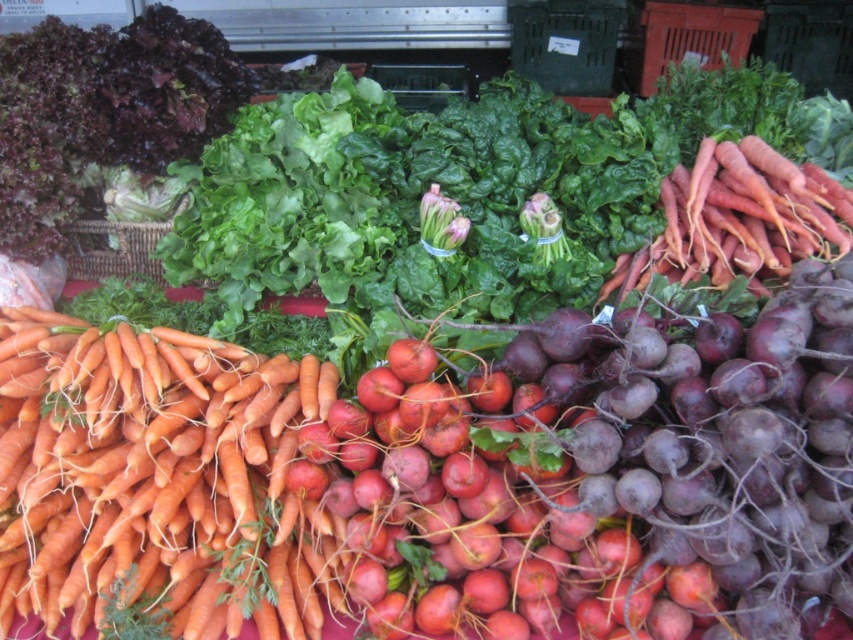
In the scene shown: You are a customer at the market stall and want to buy carrots. You see two groups of orange matte carrots at left and orange matte carrots at upper right. Which group has bigger carrots?

The orange matte carrots at left are larger in size than the orange matte carrots at upper right, so the group at the left has bigger carrots.

You are a customer at the market stall and want to grab both the orange matte carrots at left and the orange matte carrots at upper right. Which carrots should you pick up first if you want to reach the ones that are lower in the display?

You should pick up the orange matte carrots at left first because they are located below the orange matte carrots at upper right, making them lower in the display.

You are standing in front of the market stall and want to pick up two items. The first item is at point (235, 349) and the second item is at point (775, 243). Which item should you reach for first to minimize the distance you have to move your hand?

You should reach for the item at point (235, 349) first because it is closer to you than the item at point (775, 243), so you can pick it up with less movement.